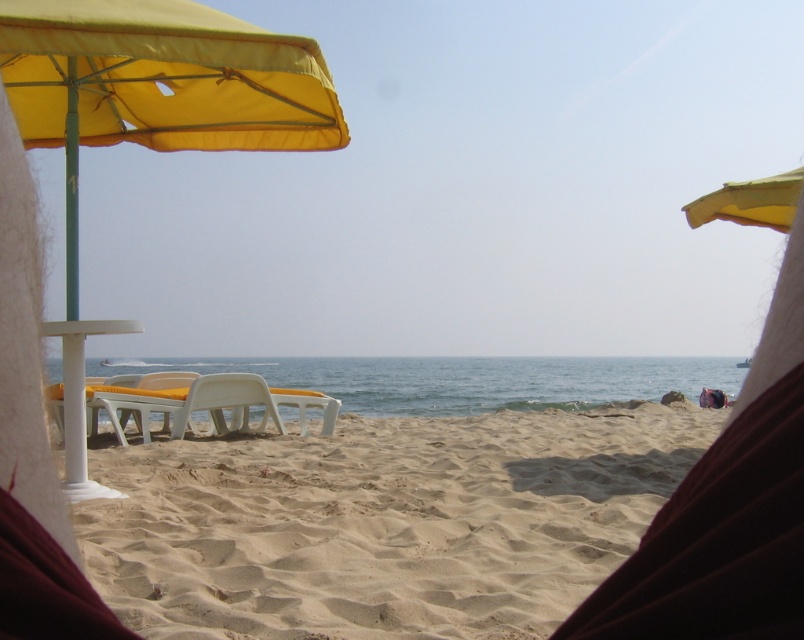
Can you confirm if sandy beach at center is smaller than yellow fabric umbrella at left?

No, sandy beach at center is not smaller than yellow fabric umbrella at left.

In the scene shown: Can you confirm if sandy beach at center is thinner than yellow fabric umbrella at left?

Incorrect, sandy beach at center's width is not less than yellow fabric umbrella at left's.

At what (x,y) coordinates should I click in order to perform the action: click on sandy beach at center. Please return your answer as a coordinate pair (x, y). This screenshot has width=804, height=640. Looking at the image, I should click on (384, 524).

Find the location of a particular element. sandy beach at center is located at coordinates (384, 524).

Can you confirm if sandy beach at center is shorter than yellow matte umbrella at upper right?

No.

This screenshot has width=804, height=640. Describe the element at coordinates (384, 524) in the screenshot. I see `sandy beach at center` at that location.

Where is `sandy beach at center`? Image resolution: width=804 pixels, height=640 pixels. sandy beach at center is located at coordinates (384, 524).

Between point (349, 572) and point (55, 131), which one is positioned in front?

Point (349, 572)

You are a GUI agent. You are given a task and a screenshot of the screen. Output one action in this format:
    pyautogui.click(x=<x>, y=<y>)
    Task: Click on the sandy beach at center
    The height and width of the screenshot is (640, 804).
    Given the screenshot: What is the action you would take?
    pyautogui.click(x=384, y=524)

Describe the element at coordinates (384, 524) in the screenshot. I see `sandy beach at center` at that location.

This screenshot has width=804, height=640. I want to click on sandy beach at center, so click(384, 524).